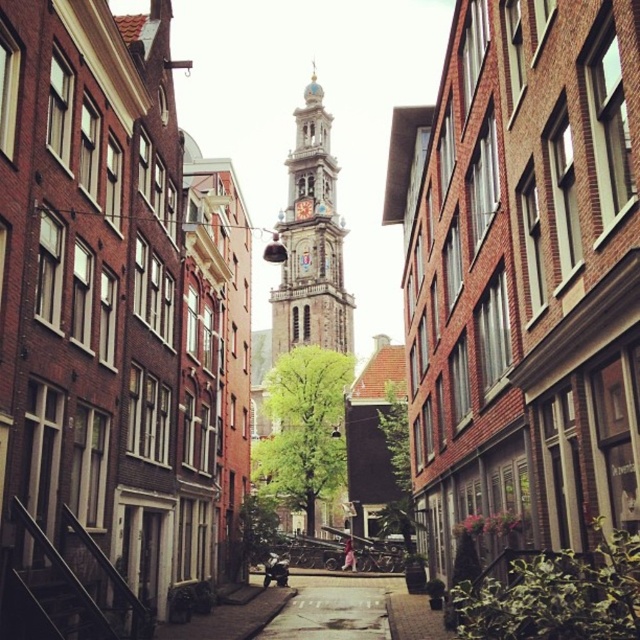
Between point (282, 259) and point (387, 637), which one is positioned in front?

Positioned in front is point (387, 637).

Can you confirm if smooth stone clock tower at center is positioned above smooth concrete pavement at center?

Indeed, smooth stone clock tower at center is positioned over smooth concrete pavement at center.

Identify the location of smooth stone clock tower at center. (310, 241).

In order to click on smooth stone clock tower at center in this screenshot , I will do `click(310, 241)`.